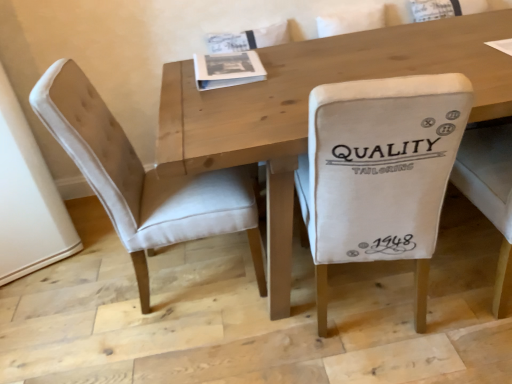
Question: Is white fabric chair at center, the 2th chair when ordered from left to right, spatially inside beige fabric chair at left, the 2th chair in the right-to-left sequence, or outside of it?

Choices:
 (A) inside
 (B) outside

Answer: (B)

Question: Is point (422, 289) closer or farther from the camera than point (138, 261)?

Choices:
 (A) farther
 (B) closer

Answer: (B)

Question: Considering the real-world distances, which object is farthest from the beige fabric chair at left, the 2th chair in the right-to-left sequence?

Choices:
 (A) white paper book at center
 (B) white fabric chair at center, the first chair from the right
 (C) wooden table at center

Answer: (B)

Question: Which object is positioned closest to the white paper book at center?

Choices:
 (A) white fabric chair at center, the first chair from the right
 (B) wooden table at center
 (C) beige fabric chair at left, the 2th chair in the right-to-left sequence

Answer: (B)